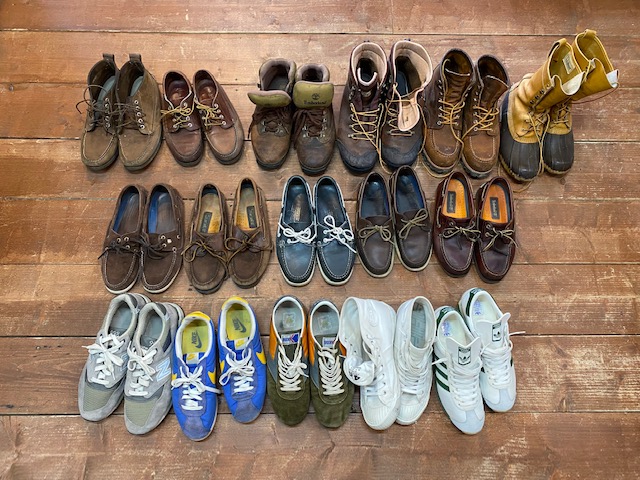
The image size is (640, 480). I want to click on floor boards, so 56,459, 52,374, 57,300, 60,224, 49,165, 49,107, 54,58, 64,12.